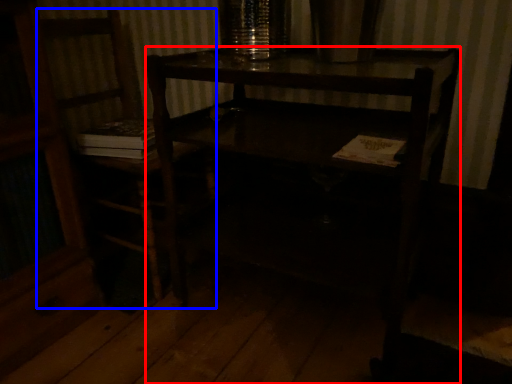
Question: Which point is further to the camera, desk (highlighted by a red box) or chair (highlighted by a blue box)?

Choices:
 (A) desk
 (B) chair

Answer: (B)